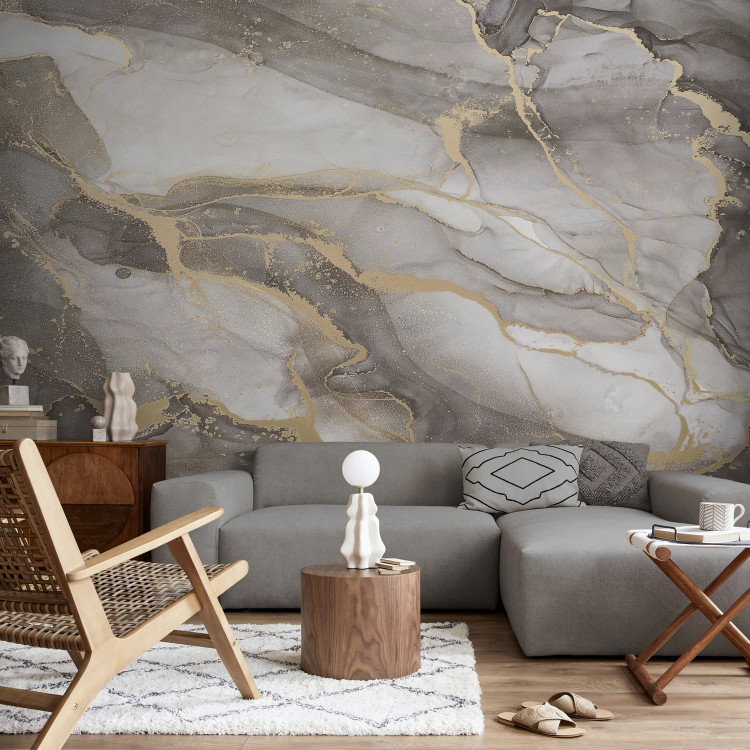
The height and width of the screenshot is (750, 750). Identify the location of 1 wooden surface. (507, 682).